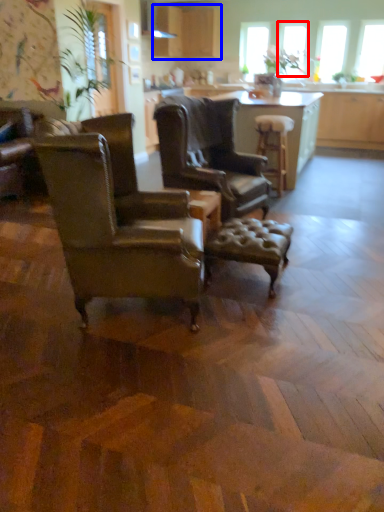
Question: Which object is closer to the camera taking this photo, window screen (highlighted by a red box) or cabinetry (highlighted by a blue box)?

Choices:
 (A) window screen
 (B) cabinetry

Answer: (B)